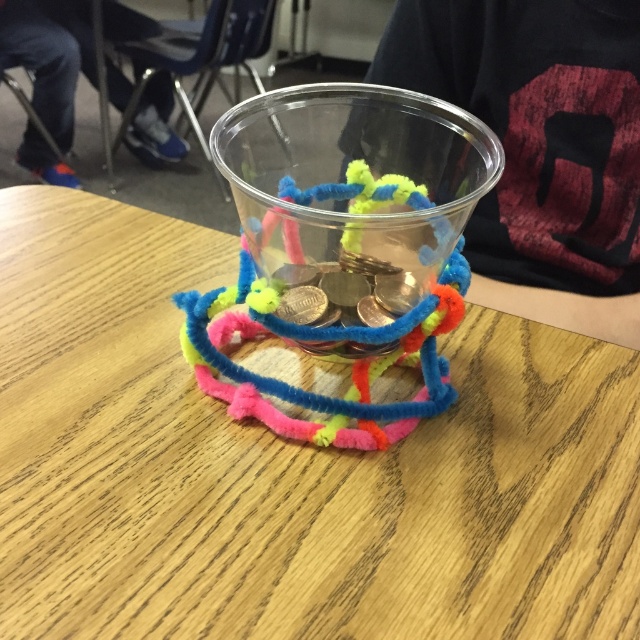
Question: Does translucent plastic cup at center appear under shiny metallic coins at center?

Choices:
 (A) no
 (B) yes

Answer: (A)

Question: Which point appears farthest from the camera in this image?

Choices:
 (A) (308, 202)
 (B) (372, 346)

Answer: (A)

Question: Which point is closer to the camera?

Choices:
 (A) shiny metallic coins at center
 (B) translucent plastic cup at center
 (C) wooden table at center

Answer: (C)

Question: In this image, where is translucent plastic cup at center located relative to shiny metallic coins at center?

Choices:
 (A) right
 (B) left

Answer: (A)

Question: Which object appears farthest from the camera in this image?

Choices:
 (A) translucent plastic cup at center
 (B) wooden table at center
 (C) shiny metallic coins at center

Answer: (C)

Question: Is the position of wooden table at center less distant than that of translucent plastic cup at center?

Choices:
 (A) no
 (B) yes

Answer: (B)